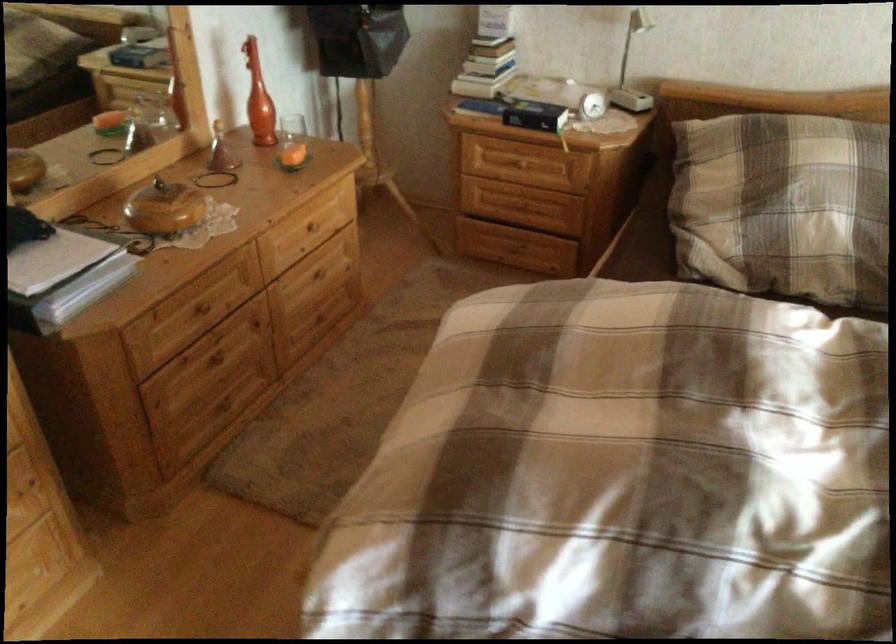
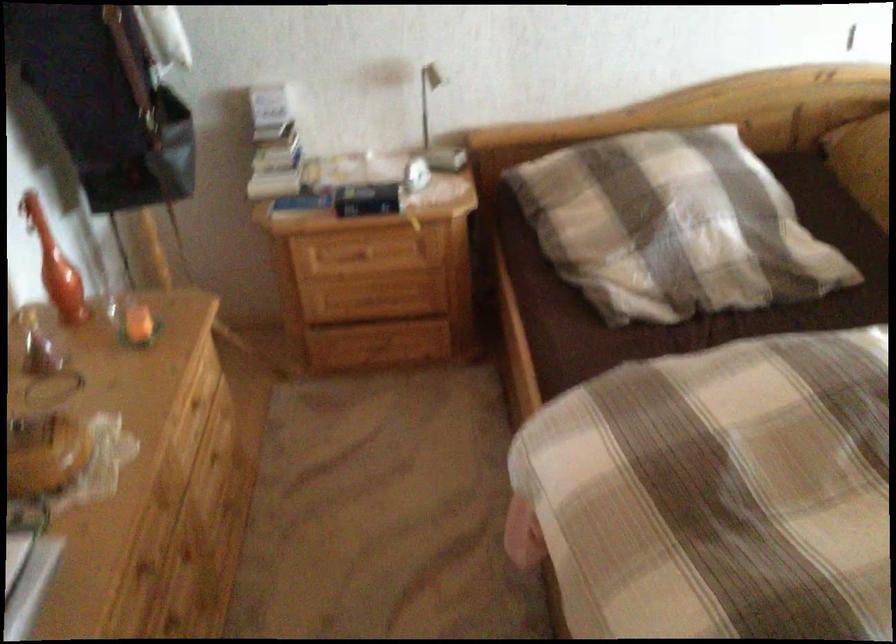
Where in the second image is the point corresponding to (x=487, y=104) from the first image?

(304, 202)